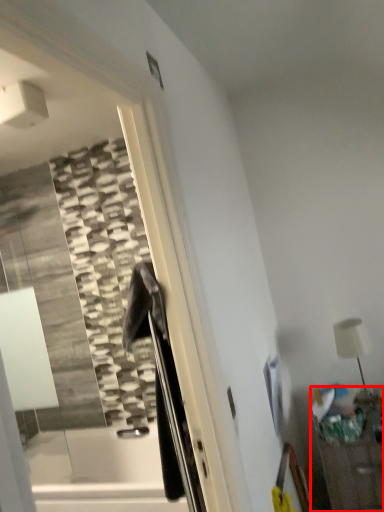
Question: In this image, where is furniture (annotated by the red box) located relative to table lamp?

Choices:
 (A) left
 (B) right

Answer: (B)